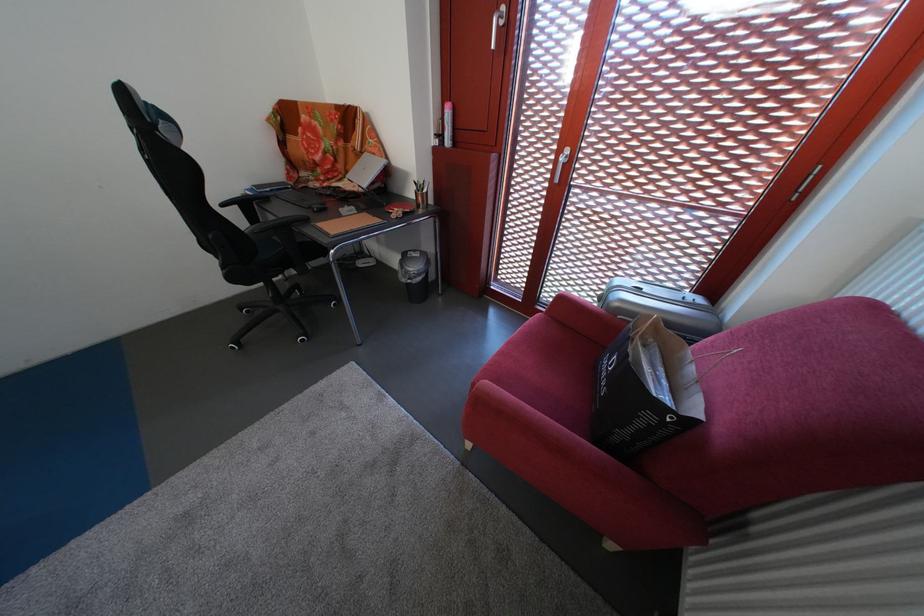
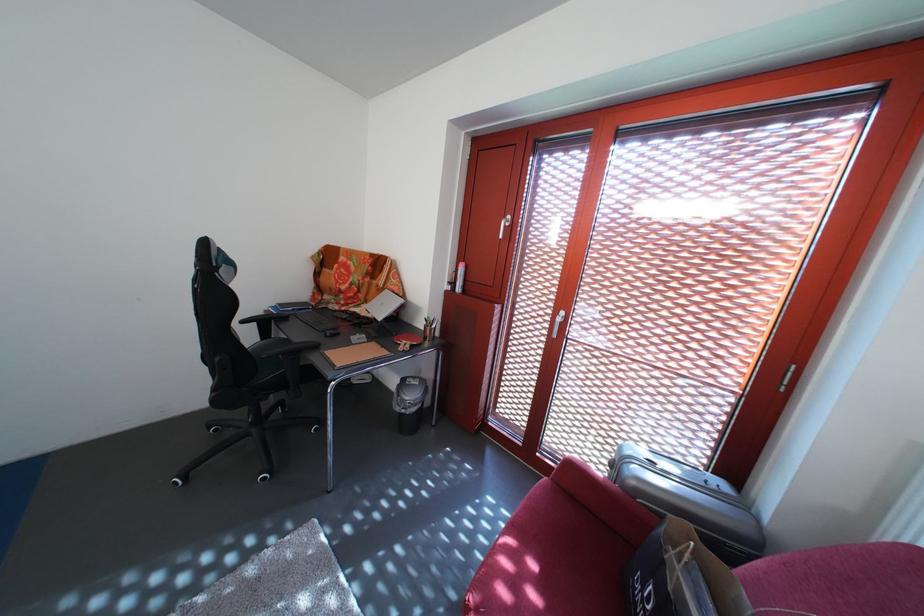
Locate, in the second image, the point that corresponds to the point at 415,286 in the first image.

(408, 416)